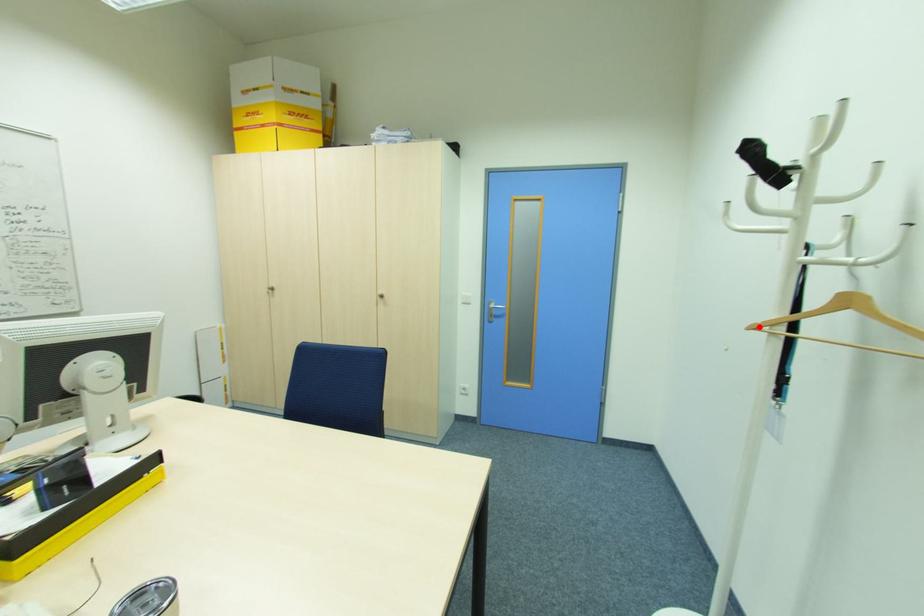
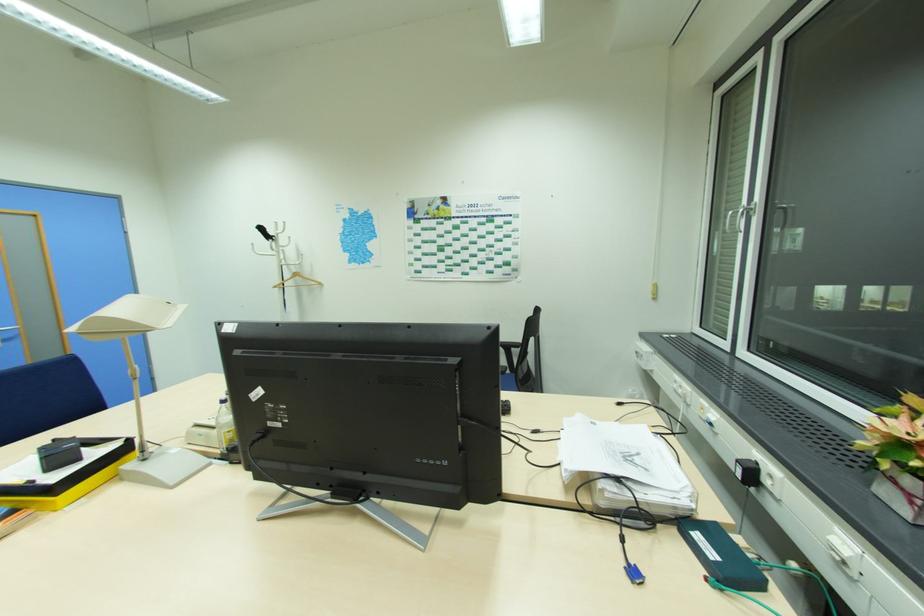
In the second image, find the point that corresponds to the highlighted location in the first image.

(277, 286)